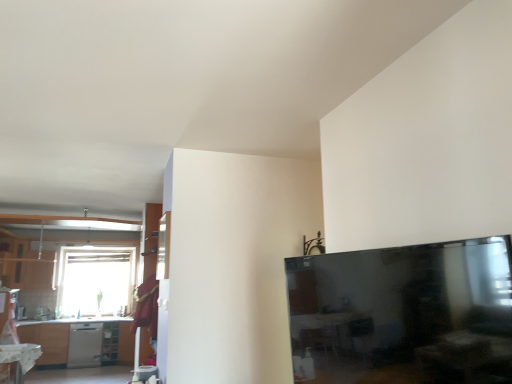
Question: From the image's perspective, is satin silver dishwasher at lower left located beneath white glossy table at lower left?

Choices:
 (A) yes
 (B) no

Answer: (A)

Question: Can you confirm if satin silver dishwasher at lower left is thinner than white glossy table at lower left?

Choices:
 (A) no
 (B) yes

Answer: (A)

Question: Does satin silver dishwasher at lower left have a greater height compared to white glossy table at lower left?

Choices:
 (A) yes
 (B) no

Answer: (A)

Question: Is satin silver dishwasher at lower left facing towards white glossy table at lower left?

Choices:
 (A) no
 (B) yes

Answer: (B)

Question: Is white glossy table at lower left located within satin silver dishwasher at lower left?

Choices:
 (A) yes
 (B) no

Answer: (B)

Question: From a real-world perspective, is matte wood cabinet at left above or below transparent glass window at upper left?

Choices:
 (A) above
 (B) below

Answer: (A)

Question: Is matte wood cabinet at left taller or shorter than transparent glass window at upper left?

Choices:
 (A) tall
 (B) short

Answer: (B)

Question: Is matte wood cabinet at left wider or thinner than transparent glass window at upper left?

Choices:
 (A) wide
 (B) thin

Answer: (A)

Question: Choose the correct answer: Is matte wood cabinet at left inside transparent glass window at upper left or outside it?

Choices:
 (A) inside
 (B) outside

Answer: (B)

Question: Is matte wood cabinet at left spatially inside white glossy table at lower left, or outside of it?

Choices:
 (A) inside
 (B) outside

Answer: (B)

Question: From a real-world perspective, is matte wood cabinet at left physically located above or below white glossy table at lower left?

Choices:
 (A) below
 (B) above

Answer: (B)

Question: Considering the positions of point (4, 230) and point (24, 355), is point (4, 230) closer or farther from the camera than point (24, 355)?

Choices:
 (A) farther
 (B) closer

Answer: (A)

Question: Relative to white glossy table at lower left, is matte wood cabinet at left in front or behind?

Choices:
 (A) behind
 (B) front

Answer: (A)

Question: Is white glossy table at lower left wider or thinner than satin silver dishwasher at lower left?

Choices:
 (A) thin
 (B) wide

Answer: (A)

Question: Would you say white glossy table at lower left is to the left or to the right of satin silver dishwasher at lower left in the picture?

Choices:
 (A) right
 (B) left

Answer: (A)